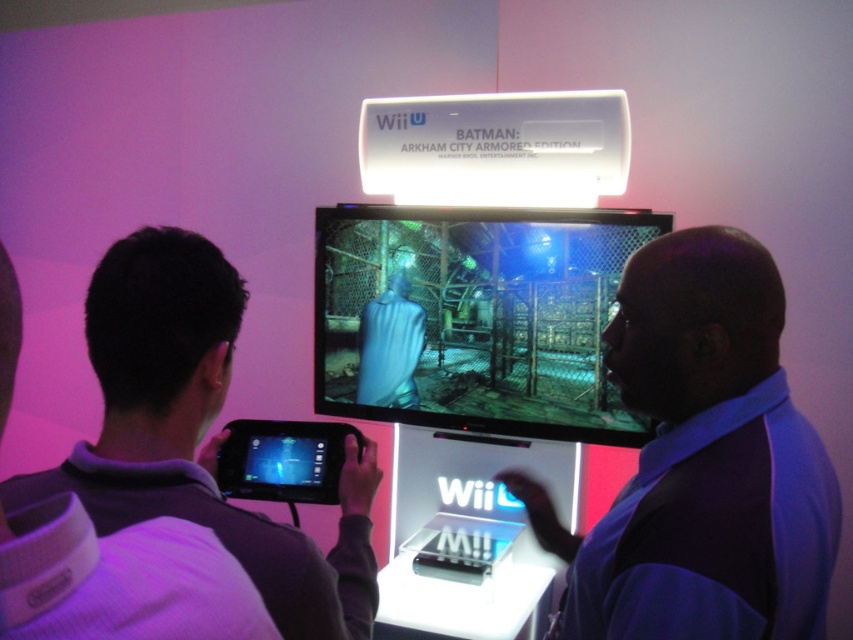
You are a photographer at the event and need to capture a clear photo of the black plastic handheld device at lower center without the purple fabric shirt at upper left blocking it. What adjustment can you make to frame the shot properly?

The purple fabric shirt at upper left is positioned over the black plastic handheld device at lower center. To frame the shot properly, you should angle the camera downward so that the purple fabric shirt at upper left moves out of the frame or shifts below the black plastic handheld device at lower center, ensuring it is no longer blocking the view.

You are a photographer at the event. You want to take a photo of the matte black monitor at center and the black plastic handheld device at lower center. Which object should you focus on first to ensure both are in focus?

The black plastic handheld device at lower center is behind the matte black monitor at center, so you should focus on the matte black monitor at center first to ensure both are in focus.

You are a photographer at the event and need to capture a clear photo of the black plastic handheld device at lower center without the purple fabric shirt at upper left blocking it. How can you adjust your position to achieve this?

Move to a position where the purple fabric shirt at upper left is no longer in front of the black plastic handheld device at lower center. Since the purple fabric shirt at upper left is currently in front of the black plastic handheld device at lower center, moving your camera angle or repositioning yourself to the side or behind the shirt will allow you to capture the handheld device without obstruction.